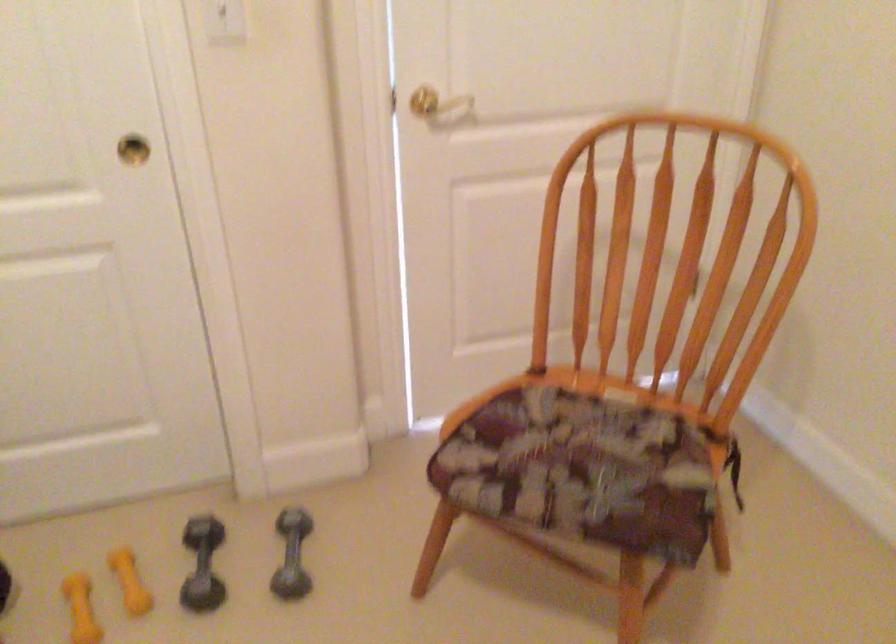
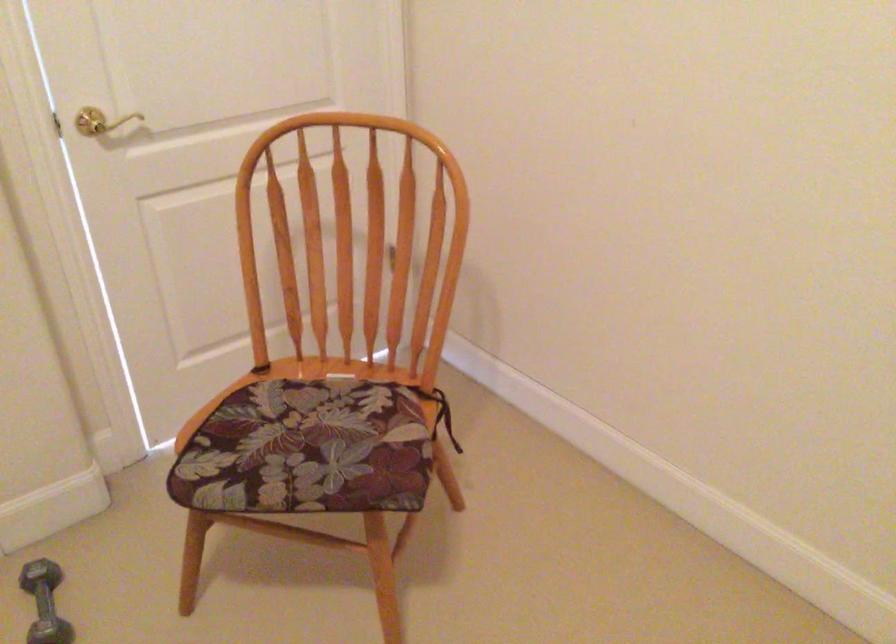
Question: Which direction would the cameraman need to move to produce the second image? Reply with the corresponding letter.

Choices:
 (A) Left
 (B) Right
 (C) Forward
 (D) Backward

Answer: (D)